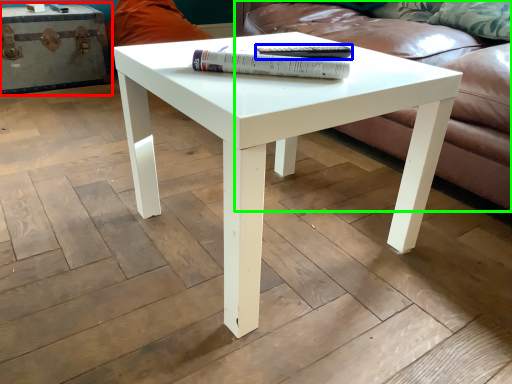
Question: Estimate the real-world distances between objects in this image. Which object is farther from chest (highlighted by a red box), paperback book (highlighted by a blue box) or studio couch (highlighted by a green box)?

Choices:
 (A) paperback book
 (B) studio couch

Answer: (A)